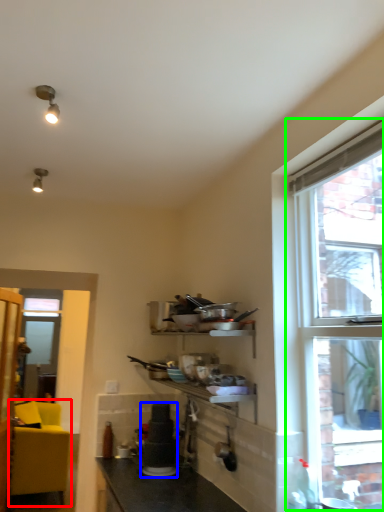
Question: Which is farther away from studio couch (highlighted by a red box)? appliance (highlighted by a blue box) or window (highlighted by a green box)?

Choices:
 (A) appliance
 (B) window

Answer: (B)